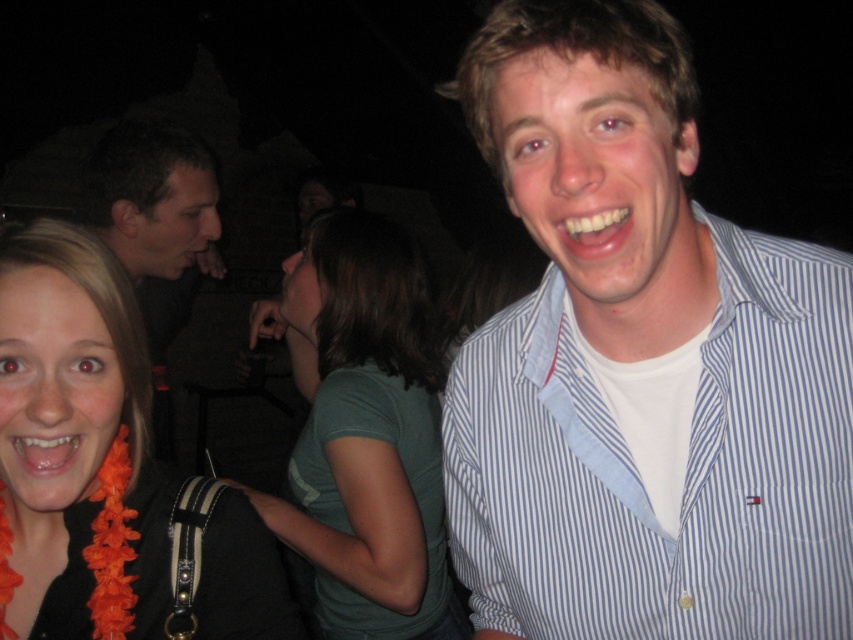
Who is lower down, white striped shirt at upper right or green matte shirt at center?

Positioned lower is green matte shirt at center.

What do you see at coordinates (685, 470) in the screenshot?
I see `white striped shirt at upper right` at bounding box center [685, 470].

What are the coordinates of `white striped shirt at upper right` in the screenshot? It's located at (685, 470).

Can you confirm if white striped shirt at upper right is positioned below dark brown hair at upper left?

Indeed, white striped shirt at upper right is positioned under dark brown hair at upper left.

Between point (502, 474) and point (102, 154), which one is positioned in front?

Positioned in front is point (502, 474).

Which is behind, point (492, 428) or point (149, 195)?

Positioned behind is point (149, 195).

At what (x,y) coordinates should I click in order to perform the action: click on white striped shirt at upper right. Please return your answer as a coordinate pair (x, y). This screenshot has width=853, height=640. Looking at the image, I should click on (685, 470).

Does orange flower garland at left have a larger size compared to dark brown hair at upper left?

No.

Who is more distant from viewer, (196, 608) or (206, 269)?

The point (206, 269) is more distant.

This screenshot has height=640, width=853. I want to click on orange flower garland at left, so click(x=103, y=468).